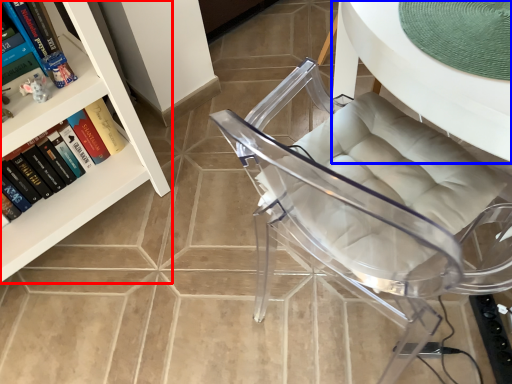
Question: Which object is further to the camera taking this photo, bookcase (highlighted by a red box) or table (highlighted by a blue box)?

Choices:
 (A) bookcase
 (B) table

Answer: (A)